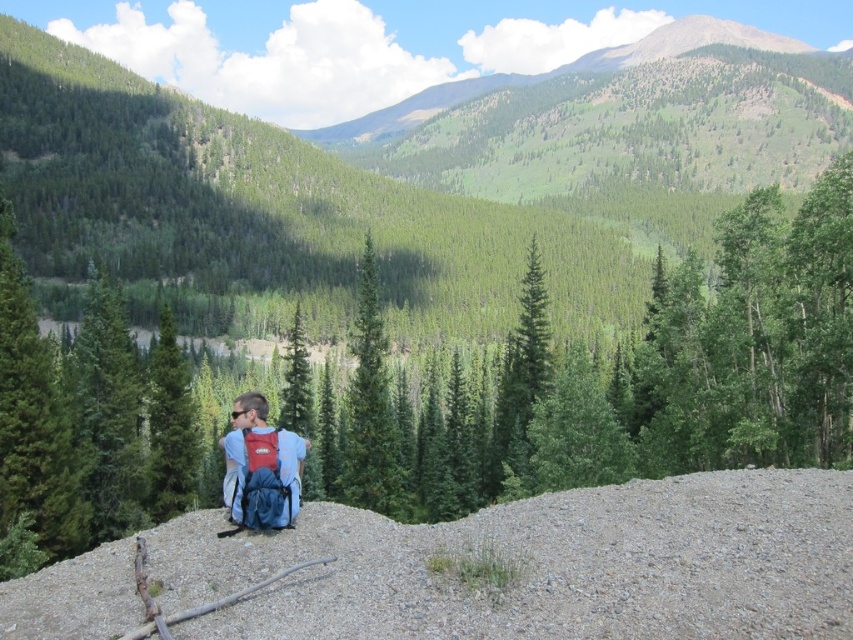
You are a photographer trying to capture a landscape photo that includes both the green matte tree at center and the matte blue backpack at center. Based on their sizes, which object should you focus on to ensure both fit in the frame?

The green matte tree at center might be wider than the matte blue backpack at center, so focusing on the tree would ensure both fit in the frame since it requires more space.

From the picture: You are a photographer aiming to capture the matte blue backpack at center and the green textured tree at center in a single shot. Since you want the backpack to be visible, is the current arrangement of the two objects obstructing your view of the backpack?

The matte blue backpack at center is behind the green textured tree at center, so the tree is blocking the view of the backpack. To capture both clearly, you would need to adjust your angle or move the backpack forward.

You are a hiker trying to decide which tree to rest under. You see a green textured tree at center and a green matte tree at center. Which tree is bigger?

The green textured tree at center is larger in size compared to the green matte tree at center.